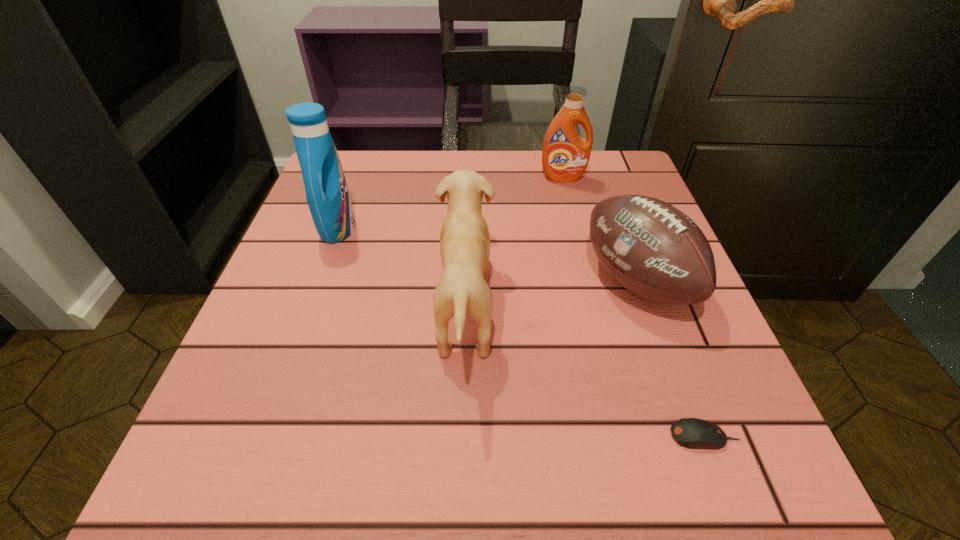
You are a GUI agent. You are given a task and a screenshot of the screen. Output one action in this format:
    pyautogui.click(x=<x>, y=<y>)
    Task: Click on the vacant space located 0.080m on the left side of the puppy
    
    Given the screenshot: What is the action you would take?
    [x=541, y=309]

This screenshot has height=540, width=960. I want to click on free spot located 0.290m on the left of the football (American), so click(423, 281).

The width and height of the screenshot is (960, 540). In order to click on vacant space located on the back of the shortest object in this screenshot , I will do `click(635, 250)`.

Where is `object positioned at the near edge`? Image resolution: width=960 pixels, height=540 pixels. object positioned at the near edge is located at coordinates tap(694, 433).

You are a GUI agent. You are given a task and a screenshot of the screen. Output one action in this format:
    pyautogui.click(x=<x>, y=<y>)
    Task: Click on the object located at the left edge
    
    Given the screenshot: What is the action you would take?
    pyautogui.click(x=327, y=195)

Where is `detergent located in the right edge section of the desktop`? This screenshot has width=960, height=540. detergent located in the right edge section of the desktop is located at coordinates (565, 155).

Locate an element on the screen. football (American) that is at the right edge is located at coordinates (651, 248).

Identify the location of computer mouse located at the right edge. Image resolution: width=960 pixels, height=540 pixels. (694, 433).

This screenshot has height=540, width=960. I want to click on object that is positioned at the far left corner, so click(327, 195).

Where is `object present at the far right corner`? object present at the far right corner is located at coordinates (565, 155).